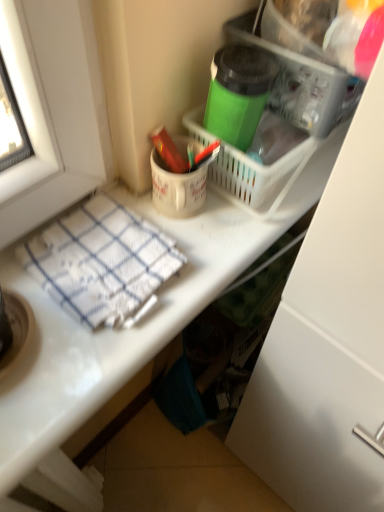
You are a GUI agent. You are given a task and a screenshot of the screen. Output one action in this format:
    pyautogui.click(x=<x>, y=<y>)
    Task: Click on the free spot above white woven towel at lower left (from a real-world perspective)
    
    Given the screenshot: What is the action you would take?
    pyautogui.click(x=102, y=250)